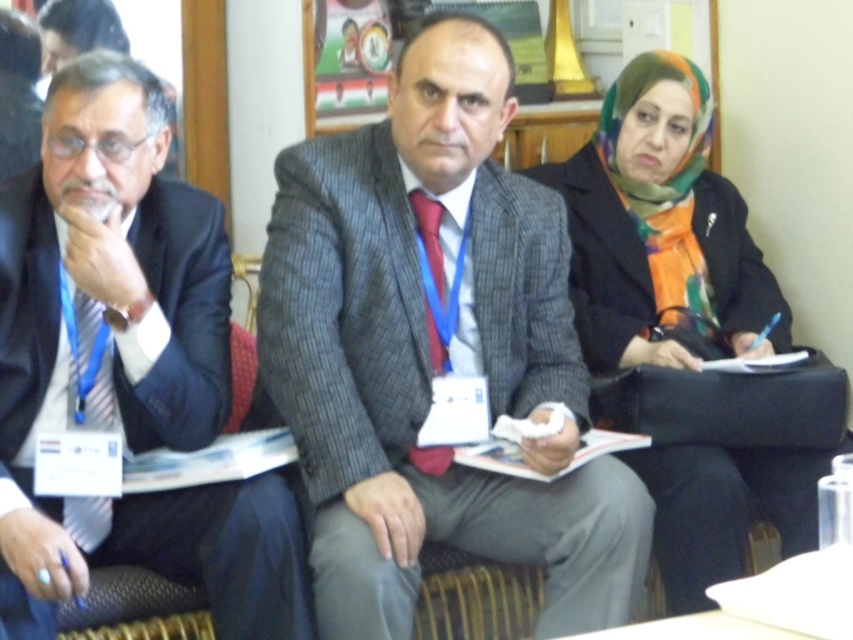
You are organizing a photo shoot and need to position two props in the scene. The props must be placed to the right of the textured gray suit at center and to the left of the multicolored scarf at right. Is there enough space between them to place both props without overlapping?

The textured gray suit at center is to the left of the multicolored scarf at right, so there is space between them to place both props without overlapping.

You are a photographer adjusting your camera to focus on two specific points in the image. The first point is at coordinates point (450, 221) and the second point is at point (151, 102). Which point should you focus on first to ensure proper depth of field?

You should focus on point (450, 221) first because it is closer to the camera than point (151, 102), ensuring proper depth of field.